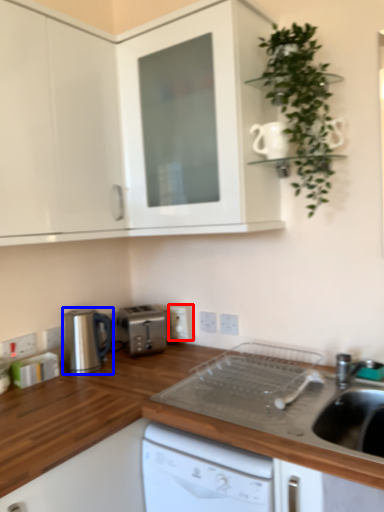
Question: Which object is further to the camera taking this photo, electric outlet (highlighted by a red box) or home appliance (highlighted by a blue box)?

Choices:
 (A) electric outlet
 (B) home appliance

Answer: (A)